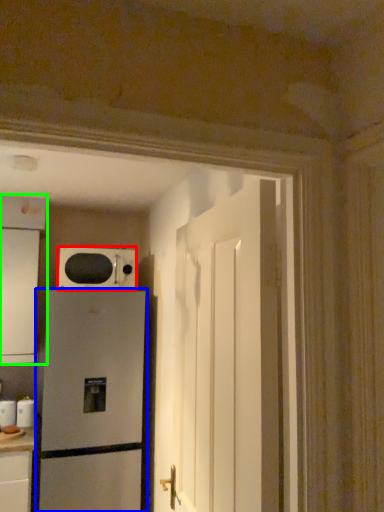
Question: Which is farther away from microwave oven (highlighted by a red box)? refrigerator (highlighted by a blue box) or cabinetry (highlighted by a green box)?

Choices:
 (A) refrigerator
 (B) cabinetry

Answer: (A)